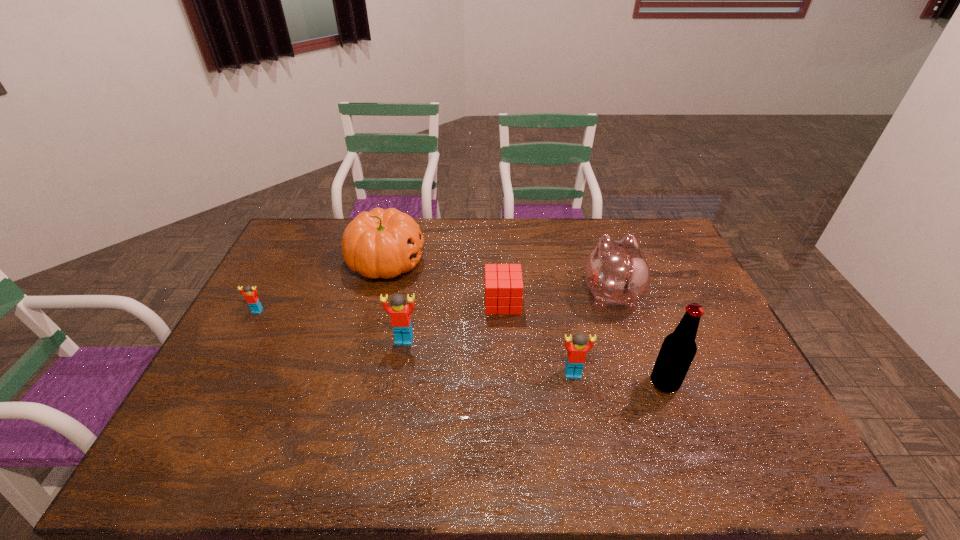
This screenshot has width=960, height=540. Identify the location of the leftmost object. (251, 297).

The height and width of the screenshot is (540, 960). Identify the location of the farthest Lego. (251, 297).

You are a GUI agent. You are given a task and a screenshot of the screen. Output one action in this format:
    pyautogui.click(x=<x>, y=<y>)
    Task: Click on the second Lego from left to right
    The image size is (960, 540).
    Given the screenshot: What is the action you would take?
    [x=400, y=313]

Locate an element on the screen. The width and height of the screenshot is (960, 540). the second farthest Lego is located at coordinates (400, 313).

Where is `the nearest Lego`? The height and width of the screenshot is (540, 960). the nearest Lego is located at coordinates (576, 356).

Locate an element on the screen. the rightmost Lego is located at coordinates pyautogui.click(x=576, y=356).

This screenshot has height=540, width=960. What are the coordinates of `the fourth object from left to right` in the screenshot? It's located at (503, 282).

Identify the location of pumpkin. The image size is (960, 540). (380, 243).

You are a GUI agent. You are given a task and a screenshot of the screen. Output one action in this format:
    pyautogui.click(x=<x>, y=<y>)
    Task: Click on the piggy bank
    The image size is (960, 540).
    Given the screenshot: What is the action you would take?
    pyautogui.click(x=617, y=273)

Locate an element on the screen. The width and height of the screenshot is (960, 540). beer bottle is located at coordinates (679, 348).